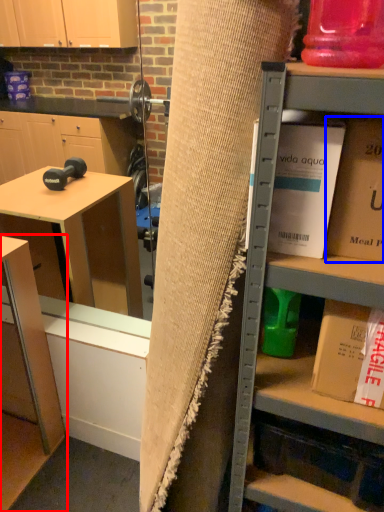
Question: Which object is closer to the camera taking this photo, table (highlighted by a red box) or book (highlighted by a blue box)?

Choices:
 (A) table
 (B) book

Answer: (B)